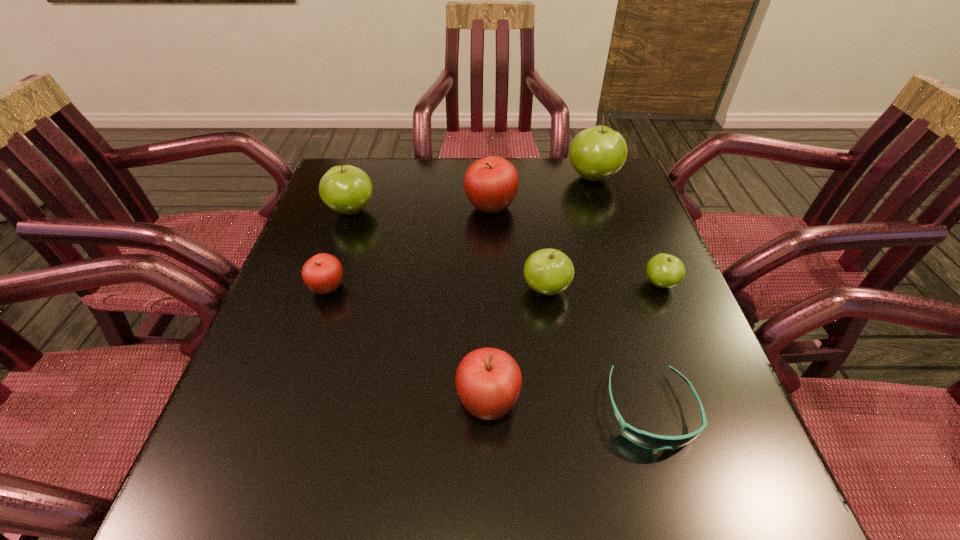
Identify the location of apple that stands as the fifth closest to the third biggest green apple. (323, 273).

Identify the location of green apple that is the second closest to the biggest red apple. (547, 271).

The height and width of the screenshot is (540, 960). I want to click on green apple that is the fourth closest to the second nearest red apple, so click(x=664, y=270).

The height and width of the screenshot is (540, 960). I want to click on red apple that is the second closest one to the tallest object, so click(x=488, y=380).

Choose which red apple is the nearest neighbor to the sunglasses. Please provide its 2D coordinates. Your answer should be formatted as a tuple, i.e. [(x, y)], where the tuple contains the x and y coordinates of a point satisfying the conditions above.

[(488, 380)]